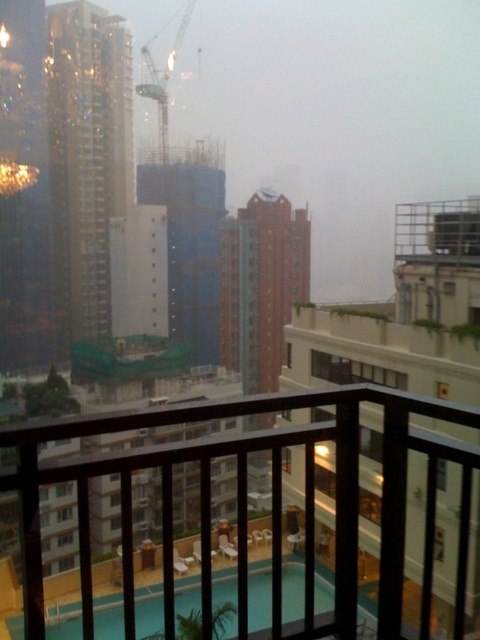
You are standing on the balcony and want to estimate how far the white concrete building at center is from you. Based on the scene, can you determine the distance?

The white concrete building at center is 8.49 feet away from the viewer.

You are a delivery drone operator. Your drone needs to fly from the metal mesh balcony at upper right to the metallic blue crane at upper center. Given that the drone has a maximum flight range of 160 meters, will it be able to reach the crane without needing to recharge?

The metal mesh balcony at upper right is 162.86 meters from the metallic blue crane at upper center. Since the drone can only fly 160 meters before needing a recharge, it cannot reach the crane without recharging.